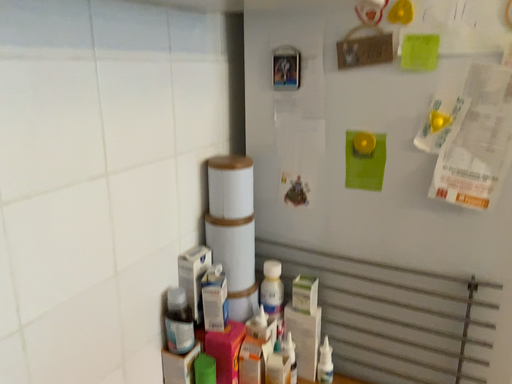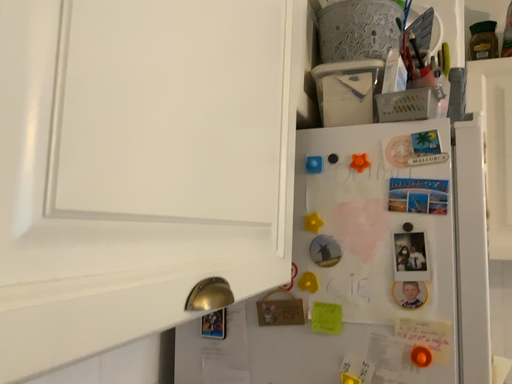
Question: How did the camera likely rotate when shooting the video?

Choices:
 (A) rotated downward
 (B) rotated upward

Answer: (B)